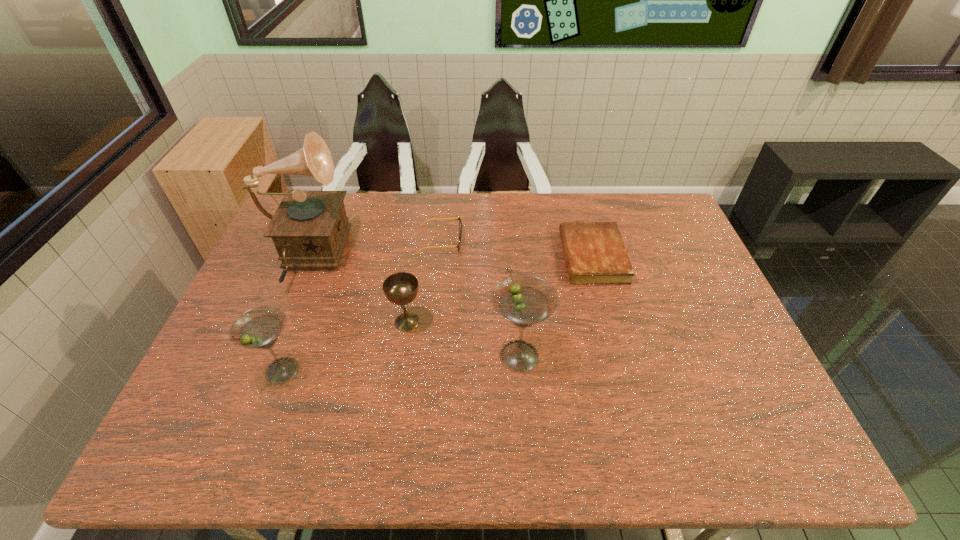
Find the location of a particular element. This screenshot has width=960, height=540. free location that satisfies the following two spatial constraints: 1. on the horn of the right martini; 2. on the right side of the record player is located at coordinates (265, 356).

You are a GUI agent. You are given a task and a screenshot of the screen. Output one action in this format:
    pyautogui.click(x=<x>, y=<y>)
    Task: Click on the vacant area in the image that satisfies the following two spatial constraints: 1. on the horn of the fifth shortest object; 2. on the right side of the tallest object
    
    Given the screenshot: What is the action you would take?
    pyautogui.click(x=265, y=356)

The height and width of the screenshot is (540, 960). Find the location of `vacant region that satisfies the following two spatial constraints: 1. on the horn of the record player; 2. on the left side of the left martini`. vacant region that satisfies the following two spatial constraints: 1. on the horn of the record player; 2. on the left side of the left martini is located at coordinates (258, 370).

I want to click on free space that satisfies the following two spatial constraints: 1. on the back side of the fourth tallest object; 2. on the horn of the record player, so click(417, 259).